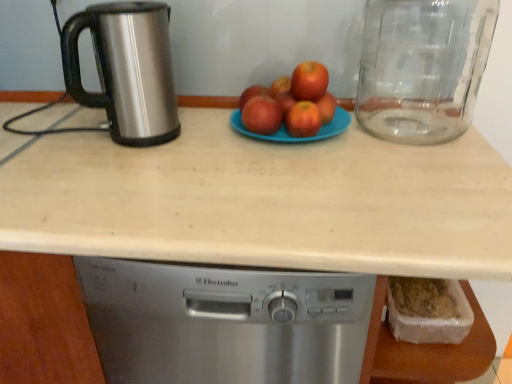
In order to click on free spot in front of matte blue plate at center in this screenshot , I will do `click(281, 176)`.